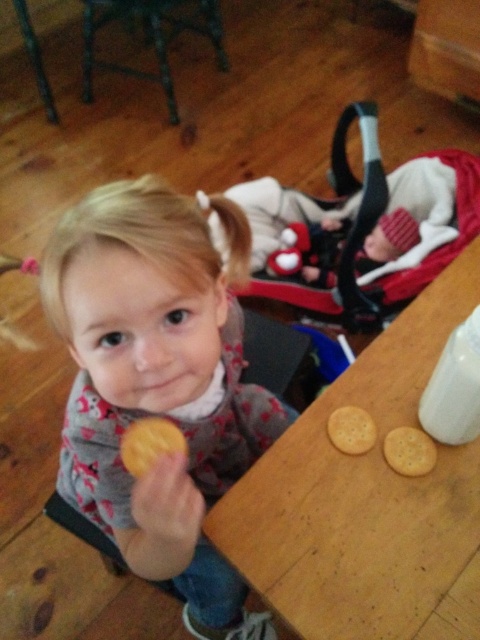
You are a photographer trying to capture the child and the objects on the table. If you want to focus on the matte pink shirt at center and the white matte bottle at upper right, which object should you adjust your camera to be closer to since the shirt is positioned to the left of the bottle?

The matte pink shirt at center is to the left of the white matte bottle at upper right, so you should adjust your camera closer to the matte pink shirt at center to capture both objects in focus.

You are a parent trying to place a soft plush baby at center on the table without blocking the crackers. Based on the coordinates provided, can you place the plush baby in a position that avoids overlapping with the crackers?

The soft plush baby at center is located at point (310, 252), so placing it there would not overlap with the crackers since the crackers are in a row on the table. However, ensure there is enough space around the coordinates to avoid blocking the crackers.